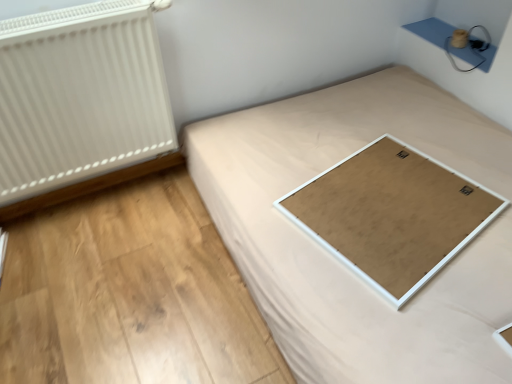
Question: Looking at their shapes, would you say natural wood plywood at lower center is wider or thinner than white matte board at center?

Choices:
 (A) thin
 (B) wide

Answer: (A)

Question: In terms of height, does natural wood plywood at lower center look taller or shorter compared to white matte board at center?

Choices:
 (A) tall
 (B) short

Answer: (B)

Question: Considering the real-world distances, which object is closest to the white textured radiator at left?

Choices:
 (A) white matte board at center
 (B) white matte board at center
 (C) natural wood plywood at lower center

Answer: (C)

Question: Considering the real-world distances, which object is closest to the white matte board at center?

Choices:
 (A) natural wood plywood at lower center
 (B) white textured radiator at left
 (C) white matte board at center

Answer: (C)